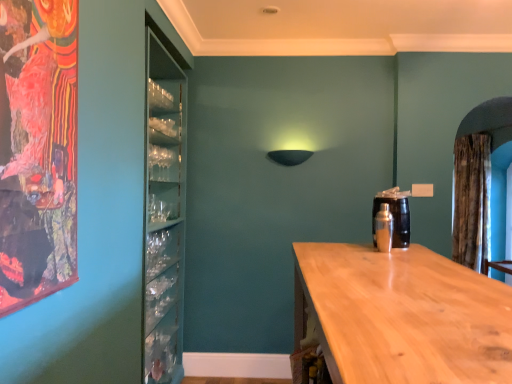
Question: From a real-world perspective, is brown textured curtain at right positioned above or below light wood countertop at center?

Choices:
 (A) below
 (B) above

Answer: (B)

Question: Considering the relative positions of brown textured curtain at right and light wood countertop at center in the image provided, is brown textured curtain at right to the left or to the right of light wood countertop at center?

Choices:
 (A) left
 (B) right

Answer: (B)

Question: Which of these objects is positioned farthest from the brown textured curtain at right?

Choices:
 (A) light wood countertop at center
 (B) silver metallic shaker at right

Answer: (A)

Question: Which of these objects is positioned closest to the light wood countertop at center?

Choices:
 (A) brown textured curtain at right
 (B) silver metallic shaker at right

Answer: (B)